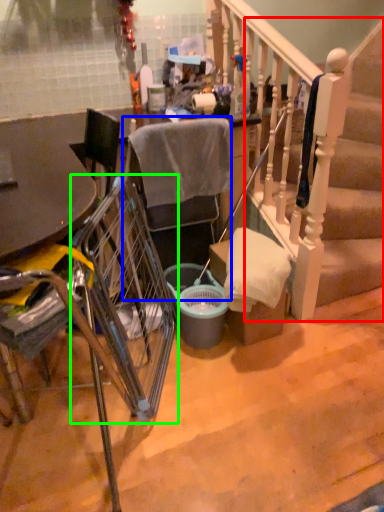
Question: Which object is positioned closest to stairs (highlighted by a red box)? Select from chair (highlighted by a blue box) and trolley (highlighted by a green box).

Choices:
 (A) chair
 (B) trolley

Answer: (A)